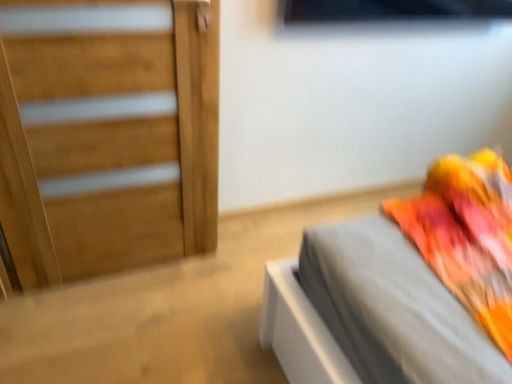
What do you see at coordinates (106, 135) in the screenshot? I see `wooden door at left` at bounding box center [106, 135].

Locate an element on the screen. The image size is (512, 384). wooden door at left is located at coordinates (106, 135).

Locate an element on the screen. The width and height of the screenshot is (512, 384). wooden door at left is located at coordinates (106, 135).